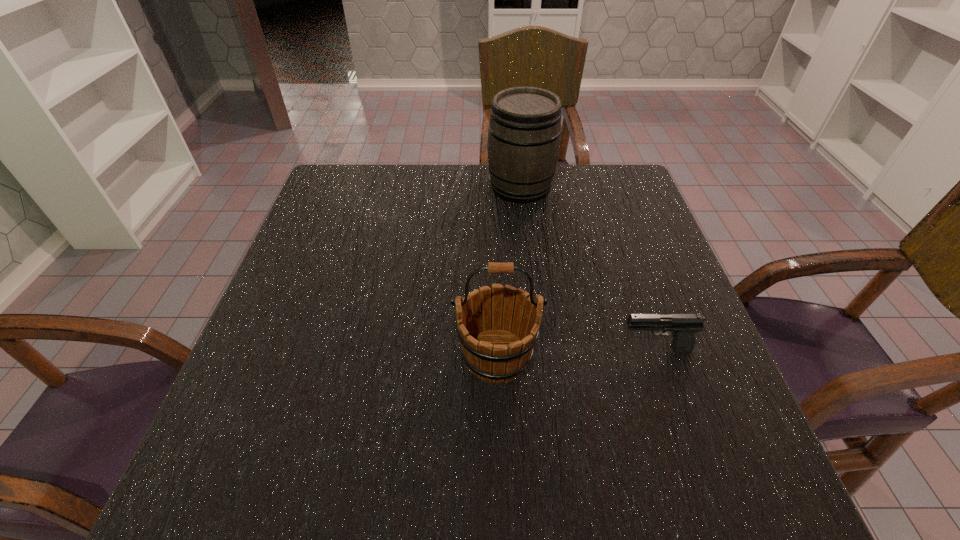
The width and height of the screenshot is (960, 540). Identify the location of object that is positioned at the right edge. (683, 327).

Identify the location of blank area at the far edge. The image size is (960, 540). (478, 167).

In the image, there is a desktop. Identify the location of vacant area at the near edge. Image resolution: width=960 pixels, height=540 pixels. (518, 489).

In order to click on vacant space at the left edge of the desktop in this screenshot , I will do `click(325, 375)`.

Where is `vacant space at the right edge`? This screenshot has width=960, height=540. vacant space at the right edge is located at coordinates (717, 429).

I want to click on vacant space at the far left corner of the desktop, so click(335, 190).

Identify the location of unoccupied position between the nearer wine bucket and the shortest object. The height and width of the screenshot is (540, 960). (576, 353).

Find the location of a particular element. The height and width of the screenshot is (540, 960). free spot between the nearer wine bucket and the shortest object is located at coordinates (576, 353).

Identify the location of free spot between the rightmost object and the nearer wine bucket. (576, 353).

Locate an element on the screen. This screenshot has height=540, width=960. vacant space that is in between the pistol and the nearer wine bucket is located at coordinates (576, 353).